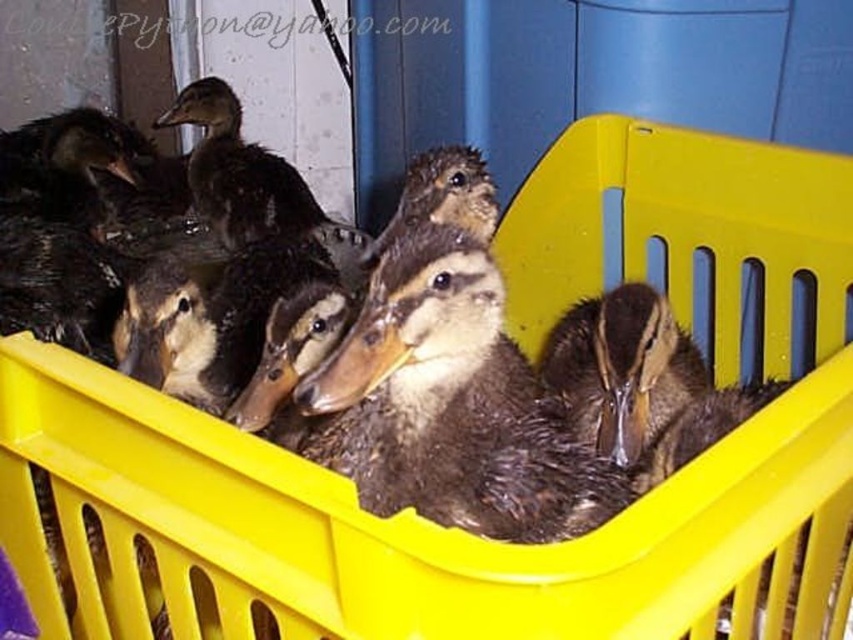
Question: Does dark brown feathers at center have a greater width compared to dark brown feathers at upper center?

Choices:
 (A) no
 (B) yes

Answer: (A)

Question: Does dark brown feathers at center come behind dark brown feathers at upper center?

Choices:
 (A) no
 (B) yes

Answer: (A)

Question: Can you confirm if dark brown feathers at center is positioned below dark brown feathers at upper center?

Choices:
 (A) no
 (B) yes

Answer: (B)

Question: Which of the following is the farthest from the observer?

Choices:
 (A) (227, 230)
 (B) (386, 419)

Answer: (A)